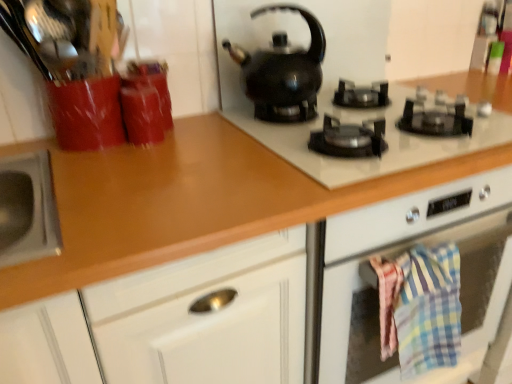
Find the location of a particular element. black glossy gas stove at upper center is located at coordinates (390, 130).

Where is `plaid cotton towel at lower right`? The image size is (512, 384). plaid cotton towel at lower right is located at coordinates (428, 309).

What do you see at coordinates (161, 204) in the screenshot? This screenshot has height=384, width=512. I see `brown glossy countertop at center` at bounding box center [161, 204].

You are a GUI agent. You are given a task and a screenshot of the screen. Output one action in this format:
    pyautogui.click(x=<x>, y=<y>)
    Task: Click on the black glossy kettle at upper center
    
    Given the screenshot: What is the action you would take?
    pyautogui.click(x=283, y=72)

Image resolution: width=512 pixels, height=384 pixels. What are the coordinates of `black glossy gas stove at upper center` in the screenshot? It's located at (390, 130).

Could you tell me if plaid cotton towel at lower right is facing black glossy kettle at upper center?

No.

Is plaid cotton towel at lower right surrounding black glossy kettle at upper center?

No, plaid cotton towel at lower right does not contain black glossy kettle at upper center.

Which of these two, plaid cotton towel at lower right or black glossy kettle at upper center, is smaller?

plaid cotton towel at lower right is smaller.

From a real-world perspective, who is located higher, black glossy kettle at upper center or brown glossy countertop at center?

black glossy kettle at upper center, from a real-world perspective.

Considering the relative sizes of black glossy kettle at upper center and brown glossy countertop at center in the image provided, is black glossy kettle at upper center smaller than brown glossy countertop at center?

Yes, black glossy kettle at upper center is smaller than brown glossy countertop at center.

From the picture: Is black glossy kettle at upper center closer to camera compared to brown glossy countertop at center?

No, the depth of black glossy kettle at upper center is greater than that of brown glossy countertop at center.

Is black glossy kettle at upper center not inside brown glossy countertop at center?

Absolutely, black glossy kettle at upper center is external to brown glossy countertop at center.

Is brown glossy countertop at center with plaid cotton towel at lower right?

No, brown glossy countertop at center is not in contact with plaid cotton towel at lower right.

Considering the sizes of objects brown glossy countertop at center and plaid cotton towel at lower right in the image provided, who is smaller, brown glossy countertop at center or plaid cotton towel at lower right?

plaid cotton towel at lower right.

Does brown glossy countertop at center appear on the right side of plaid cotton towel at lower right?

No, brown glossy countertop at center is not to the right of plaid cotton towel at lower right.

The image size is (512, 384). In order to click on blanket above the brown glossy countertop at center (from the image's perspective) in this screenshot , I will do `click(428, 309)`.

Is black glossy gas stove at upper center looking in the opposite direction of plaid cotton towel at lower right?

No, black glossy gas stove at upper center is not facing the opposite direction of plaid cotton towel at lower right.

Between black glossy gas stove at upper center and plaid cotton towel at lower right, which one has larger size?

black glossy gas stove at upper center.

Is black glossy gas stove at upper center to the left of plaid cotton towel at lower right from the viewer's perspective?

Correct, you'll find black glossy gas stove at upper center to the left of plaid cotton towel at lower right.

Identify the location of gas stove on the right of brown glossy countertop at center. This screenshot has width=512, height=384. (390, 130).

Is point (139, 224) behind point (487, 83)?

No, (139, 224) is in front of (487, 83).

Is brown glossy countertop at center wider or thinner than black glossy gas stove at upper center?

In the image, brown glossy countertop at center appears to be wider than black glossy gas stove at upper center.

Are brown glossy countertop at center and black glossy gas stove at upper center far apart?

That's not correct — brown glossy countertop at center is a little close to black glossy gas stove at upper center.

Considering the sizes of objects black glossy kettle at upper center and plaid cotton towel at lower right in the image provided, who is shorter, black glossy kettle at upper center or plaid cotton towel at lower right?

black glossy kettle at upper center is shorter.

Is the surface of black glossy kettle at upper center in direct contact with plaid cotton towel at lower right?

black glossy kettle at upper center and plaid cotton towel at lower right are clearly separated.

In the scene shown: From a real-world perspective, is black glossy kettle at upper center positioned over plaid cotton towel at lower right based on gravity?

Yes, from a real-world perspective, black glossy kettle at upper center is on top of plaid cotton towel at lower right.

Between black glossy gas stove at upper center and black glossy kettle at upper center, which one has more height?

black glossy kettle at upper center is taller.

From a real-world perspective, is black glossy gas stove at upper center physically below black glossy kettle at upper center?

Correct, in the physical world, black glossy gas stove at upper center is lower than black glossy kettle at upper center.

Is black glossy gas stove at upper center further to camera compared to black glossy kettle at upper center?

No, black glossy gas stove at upper center is in front of black glossy kettle at upper center.

Are black glossy gas stove at upper center and black glossy kettle at upper center far apart?

No, black glossy gas stove at upper center is not far from black glossy kettle at upper center.

You are a GUI agent. You are given a task and a screenshot of the screen. Output one action in this format:
    pyautogui.click(x=<x>, y=<y>)
    Task: Click on the blanket that is in front of the black glossy kettle at upper center
    
    Given the screenshot: What is the action you would take?
    pyautogui.click(x=428, y=309)

Where is `kitchen appliance that appears on the right of brown glossy countertop at center`? The image size is (512, 384). kitchen appliance that appears on the right of brown glossy countertop at center is located at coordinates (283, 72).

From the image, which object appears to be farther from black glossy gas stove at upper center, plaid cotton towel at lower right or brown glossy countertop at center?

plaid cotton towel at lower right.

From the image, which object appears to be nearer to brown glossy countertop at center, plaid cotton towel at lower right or black glossy kettle at upper center?

black glossy kettle at upper center.

From the image, which object appears to be farther from black glossy kettle at upper center, black glossy gas stove at upper center or brown glossy countertop at center?

Among the two, brown glossy countertop at center is located further to black glossy kettle at upper center.

Looking at the image, which one is located closer to black glossy kettle at upper center, plaid cotton towel at lower right or brown glossy countertop at center?

brown glossy countertop at center lies closer to black glossy kettle at upper center than the other object.

From the image, which object appears to be farther from brown glossy countertop at center, black glossy gas stove at upper center or black glossy kettle at upper center?

The object further to brown glossy countertop at center is black glossy kettle at upper center.

Considering their positions, is brown glossy countertop at center positioned closer to black glossy gas stove at upper center than plaid cotton towel at lower right?

brown glossy countertop at center is positioned closer to the anchor black glossy gas stove at upper center.

Looking at the image, which one is located closer to black glossy gas stove at upper center, black glossy kettle at upper center or brown glossy countertop at center?

Based on the image, black glossy kettle at upper center appears to be nearer to black glossy gas stove at upper center.

From the image, which object appears to be farther from black glossy gas stove at upper center, brown glossy countertop at center or black glossy kettle at upper center?

The object further to black glossy gas stove at upper center is brown glossy countertop at center.

The height and width of the screenshot is (384, 512). What are the coordinates of `blanket between black glossy kettle at upper center and brown glossy countertop at center vertically` in the screenshot? It's located at (428, 309).

The width and height of the screenshot is (512, 384). I want to click on gas stove between black glossy kettle at upper center and plaid cotton towel at lower right in the vertical direction, so click(390, 130).

This screenshot has width=512, height=384. I want to click on gas stove between brown glossy countertop at center and plaid cotton towel at lower right, so click(x=390, y=130).

I want to click on gas stove between black glossy kettle at upper center and brown glossy countertop at center in the vertical direction, so click(x=390, y=130).